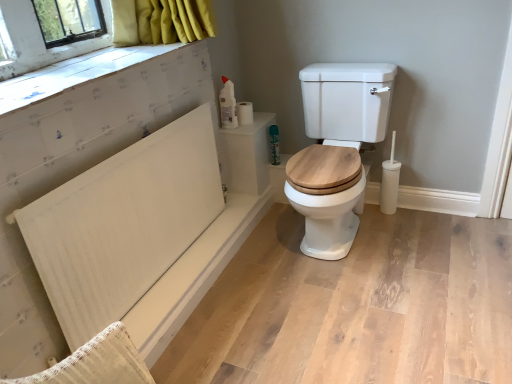
I want to click on empty space that is ontop of white textured board at upper left (from a real-world perspective), so click(79, 70).